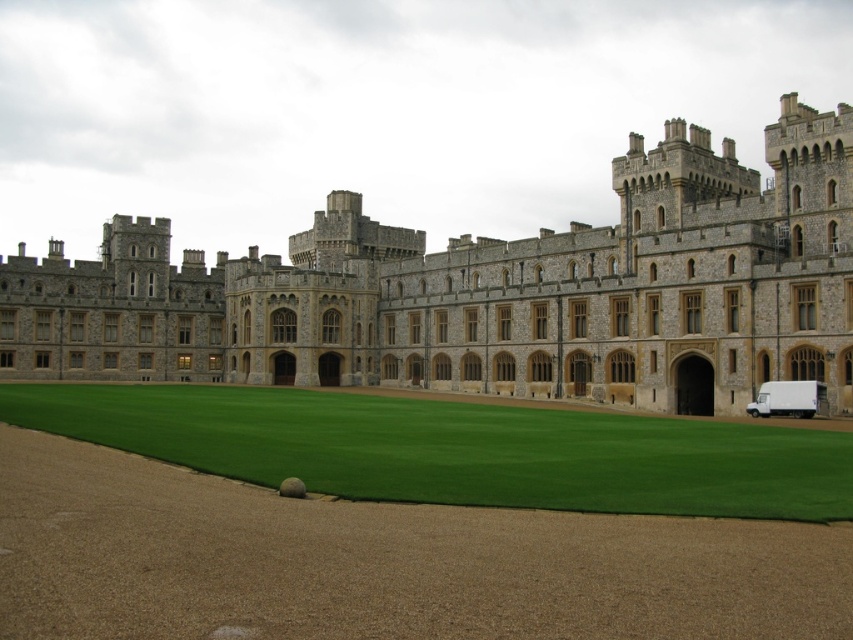
You are a visitor arriving at the historic building and want to park your car. The green artificial turf at center is part of the lawn area, and the white matte van at lower right is parked on the paved area. Which parking spot is closer to the entrance of the building?

The green artificial turf at center is closer to the viewer than the white matte van at lower right, so the parking spot where the white matte van at lower right is located is farther away from the entrance. Therefore, the green artificial turf at center is closer to the entrance and would be a better parking option.

You are standing in front of the historic building and want to take a photo. You notice two points marked on the lawn at coordinates point (714, 442) and point (811, 416). Which of these points is closer to your current position?

Point (714, 442) is closer to the camera than point (811, 416), so it is closer to your current position.